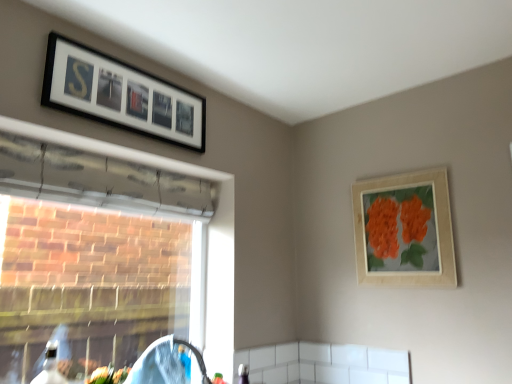
Question: Based on their positions, is black matte picture frame at upper left, which ranks as the first picture frame in top-to-bottom order, located to the left or right of wooden picture frame at upper right, which appears as the first picture frame when viewed from the right?

Choices:
 (A) left
 (B) right

Answer: (A)

Question: Does point (93, 57) appear closer or farther from the camera than point (366, 263)?

Choices:
 (A) closer
 (B) farther

Answer: (A)

Question: Which of these objects is positioned farthest from the transparent plastic window at left?

Choices:
 (A) wooden picture frame at upper right, which is counted as the 2th picture frame, starting from the top
 (B) black matte picture frame at upper left, the 2th picture frame positioned from the bottom

Answer: (A)

Question: Which object is the farthest from the wooden picture frame at upper right, which is the 1th picture frame in bottom-to-top order?

Choices:
 (A) transparent plastic window at left
 (B) black matte picture frame at upper left, the 2th picture frame positioned from the bottom

Answer: (B)